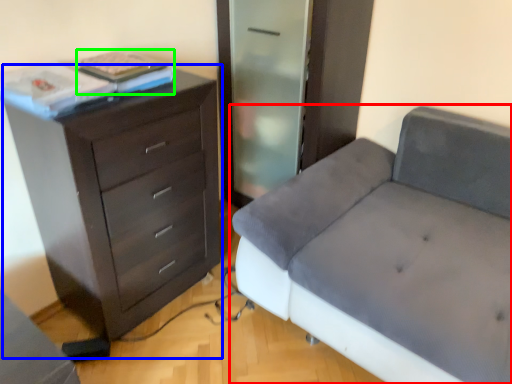
Question: Considering the real-world distances, which object is farthest from studio couch (highlighted by a red box)? chest of drawers (highlighted by a blue box) or book (highlighted by a green box)?

Choices:
 (A) chest of drawers
 (B) book

Answer: (B)